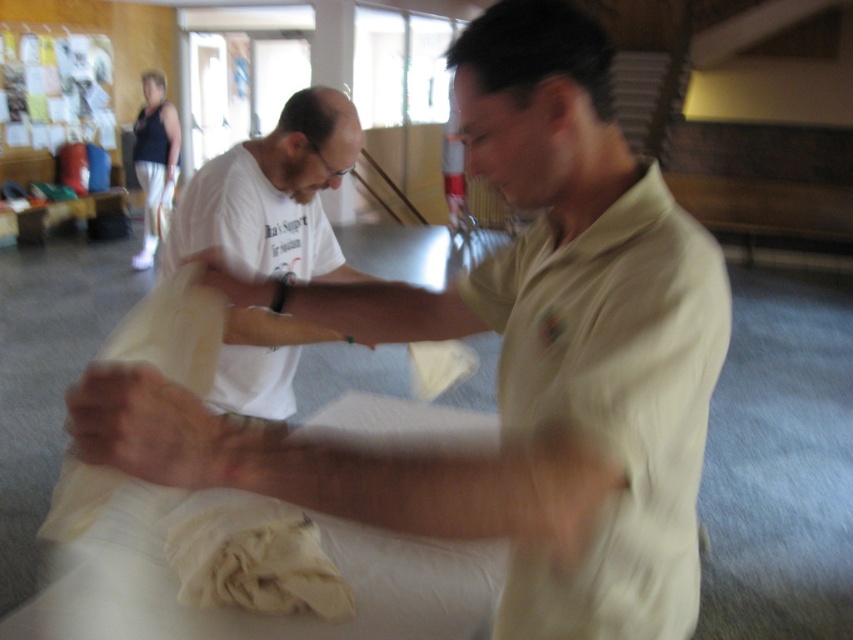
Question: Which point is closer to the camera?

Choices:
 (A) white fabric at center
 (B) white cotton shirt at center

Answer: (A)

Question: Does white cotton shirt at center have a lesser width compared to white fabric at center?

Choices:
 (A) yes
 (B) no

Answer: (B)

Question: Among these points, which one is nearest to the camera?

Choices:
 (A) [247, 275]
 (B) [264, 193]

Answer: (A)

Question: Does white cotton shirt at center have a smaller size compared to white fabric at center?

Choices:
 (A) yes
 (B) no

Answer: (B)

Question: Can you confirm if white cotton shirt at center is positioned to the right of white fabric at center?

Choices:
 (A) no
 (B) yes

Answer: (A)